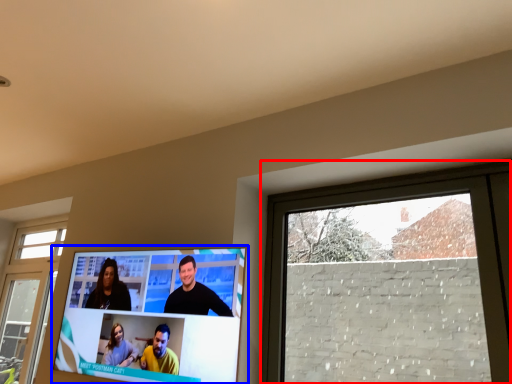
Question: Which object appears closest to the camera in this image, window (highlighted by a red box) or television (highlighted by a blue box)?

Choices:
 (A) window
 (B) television

Answer: (A)